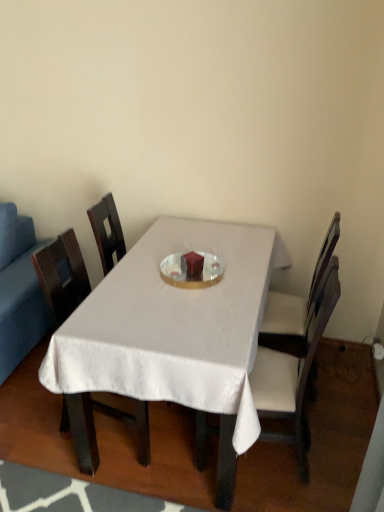
The height and width of the screenshot is (512, 384). Find the location of `free spot above white satin table at center (from a real-world perspective)`. free spot above white satin table at center (from a real-world perspective) is located at coordinates (177, 280).